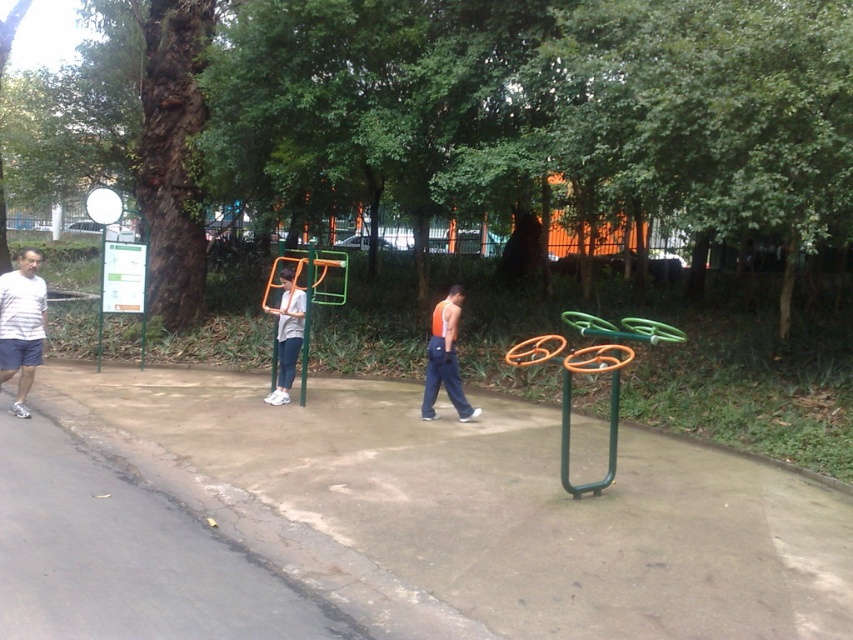
Question: Can you confirm if concrete at center is smaller than white striped shirt at left?

Choices:
 (A) yes
 (B) no

Answer: (B)

Question: Estimate the real-world distances between objects in this image. Which object is farther from the green plastic pole at center?

Choices:
 (A) orange fabric tank top at center
 (B) white striped shirt at left
 (C) green metallic signpost at left
 (D) white glossy basketball hoop at upper left

Answer: (C)

Question: Which is nearer to the matte gray shirt at center?

Choices:
 (A) orange fabric tank top at center
 (B) white glossy basketball hoop at upper left
 (C) green metallic signpost at left
 (D) concrete at center

Answer: (A)

Question: From the image, what is the correct spatial relationship of concrete at center in relation to orange fabric tank top at center?

Choices:
 (A) below
 (B) above

Answer: (A)

Question: Which object appears closest to the camera in this image?

Choices:
 (A) matte gray shirt at center
 (B) green plastic pole at center
 (C) concrete at center

Answer: (C)

Question: Does orange fabric tank top at center have a smaller size compared to matte gray shirt at center?

Choices:
 (A) no
 (B) yes

Answer: (B)